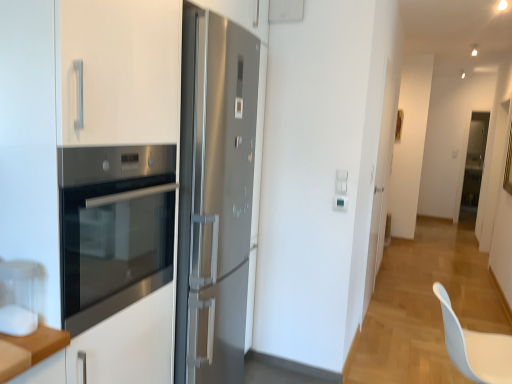
Question: In terms of width, does stainless steel oven at left look wider or thinner when compared to transparent glass door at center?

Choices:
 (A) wide
 (B) thin

Answer: (A)

Question: Is stainless steel oven at left spatially inside transparent glass door at center, or outside of it?

Choices:
 (A) outside
 (B) inside

Answer: (A)

Question: Which object is the closest to the stainless steel oven at left?

Choices:
 (A) white plastic swivel chair at lower right
 (B) white matte cabinet at left
 (C) transparent glass door at center

Answer: (B)

Question: Considering the real-world distances, which object is closest to the transparent glass door at center?

Choices:
 (A) white matte cabinet at left
 (B) stainless steel oven at left
 (C) white plastic swivel chair at lower right

Answer: (C)